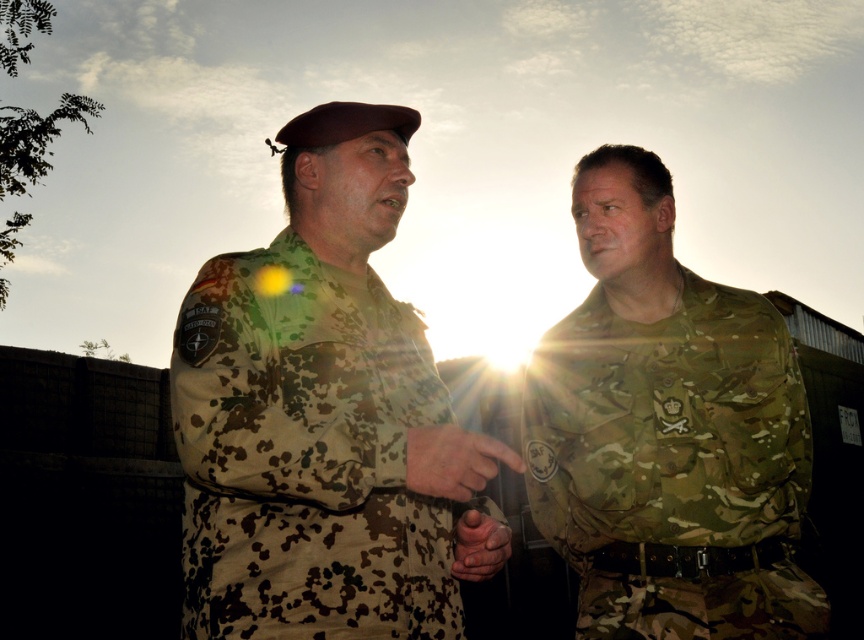
You are a photographer setting up equipment for a military photo shoot. You need to position two models wearing the camouflage uniform at center and the camouflage fabric uniform at right. The minimum safe distance between models for clear focus is 30 inches. Can you safely place them 32.47 inches apart?

The distance between the camouflage uniform at center and the camouflage fabric uniform at right is 32.47 inches, which exceeds the minimum safe distance of 30 inches. Therefore, placing them 32.47 inches apart is safe for clear focus.

Where is the camouflage uniform at center located in the image?

The camouflage uniform at center is located at point (324, 417).

You are a photographer analyzing the composition of this image. The scene has two individuals in camouflage uniforms. Based on their spatial arrangement, which of the two uniforms, the camouflage uniform at center or the camouflage fabric uniform at right, appears smaller in the frame?

The camouflage uniform at center appears smaller in the frame because it occupies less space than the camouflage fabric uniform at right.